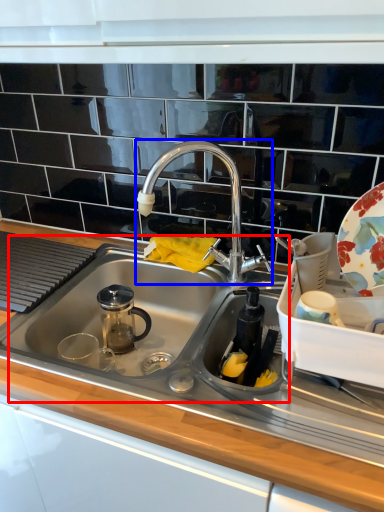
Question: Which object appears closest to the camera in this image, sink (highlighted by a red box) or tap (highlighted by a blue box)?

Choices:
 (A) sink
 (B) tap

Answer: (A)